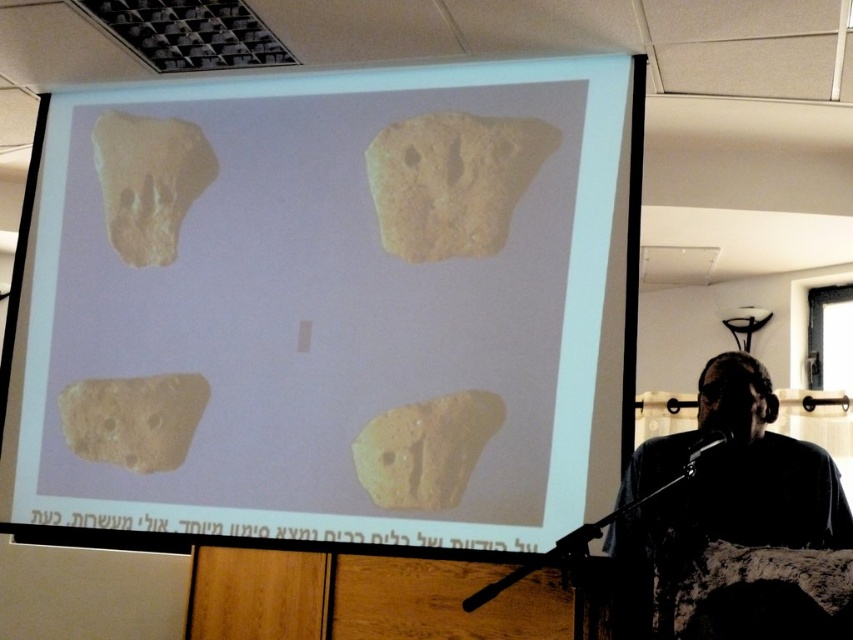
Looking at this image, does silhouette fabric at lower right have a lesser width compared to yellowish stone at center?

In fact, silhouette fabric at lower right might be wider than yellowish stone at center.

Describe the element at coordinates (732, 476) in the screenshot. I see `silhouette fabric at lower right` at that location.

Identify the location of silhouette fabric at lower right. pos(732,476).

Can you confirm if beige stone fragments at center is positioned to the left of silhouette fabric at lower right?

Correct, you'll find beige stone fragments at center to the left of silhouette fabric at lower right.

Does beige stone fragments at center lie behind silhouette fabric at lower right?

Yes, beige stone fragments at center is behind silhouette fabric at lower right.

Between point (381, 141) and point (650, 448), which one is positioned in front?

Point (650, 448)

Find the location of `beige stone fragments at center`. beige stone fragments at center is located at coordinates (337, 300).

The height and width of the screenshot is (640, 853). What do you see at coordinates (337, 300) in the screenshot?
I see `beige stone fragments at center` at bounding box center [337, 300].

Can you confirm if beige stone fragments at center is positioned above brown matte stone at lower left?

Yes, beige stone fragments at center is above brown matte stone at lower left.

The height and width of the screenshot is (640, 853). I want to click on beige stone fragments at center, so click(x=337, y=300).

You are a GUI agent. You are given a task and a screenshot of the screen. Output one action in this format:
    pyautogui.click(x=<x>, y=<y>)
    Task: Click on the beige stone fragments at center
    This screenshot has height=640, width=853.
    Given the screenshot: What is the action you would take?
    pyautogui.click(x=337, y=300)